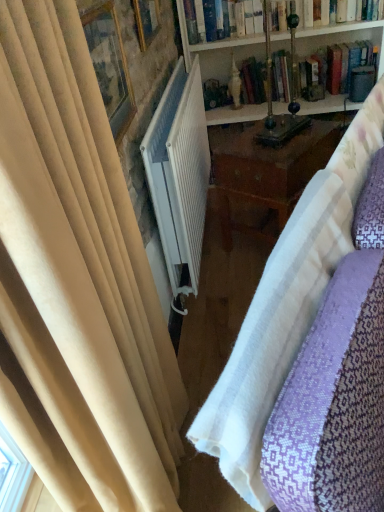
Image resolution: width=384 pixels, height=512 pixels. Find the location of `hardcover book at upper center`. hardcover book at upper center is located at coordinates (338, 28).

Describe the element at coordinates (179, 172) in the screenshot. The width and height of the screenshot is (384, 512). I see `white ribbed radiator at center` at that location.

At what (x,y) coordinates should I click in order to perform the action: click on white ribbed radiator at center. Please return your answer as a coordinate pair (x, y). Looking at the image, I should click on (179, 172).

What do you see at coordinates (271, 94) in the screenshot? Image resolution: width=384 pixels, height=512 pixels. I see `brass table lamp at center` at bounding box center [271, 94].

Locate an element on the screen. white wooden bookcase at upper center is located at coordinates (218, 50).

Identify the location of hardcover book at upper center. The image size is (384, 512). (338, 28).

Is white ribbed radiator at center at the back of white textured fabric at center?

Yes, white textured fabric at center is positioned with its back facing white ribbed radiator at center.

Does white textured fabric at center have a greater height compared to white ribbed radiator at center?

Indeed, white textured fabric at center has a greater height compared to white ribbed radiator at center.

From a real-world perspective, who is located higher, white textured fabric at center or white ribbed radiator at center?

In real-world perspective, white ribbed radiator at center is above.

Find the location of a particular element. This screenshot has width=384, height=512. radiator behind the white textured fabric at center is located at coordinates (179, 172).

Can you confirm if brass table lamp at center is shorter than hardcover book at upper center?

Incorrect, the height of brass table lamp at center does not fall short of that of hardcover book at upper center.

Is brass table lamp at center surrounding hardcover book at upper center?

No, brass table lamp at center does not contain hardcover book at upper center.

Is brass table lamp at center closer to the viewer compared to hardcover book at upper center?

Yes, the depth of brass table lamp at center is less than that of hardcover book at upper center.

Is white ribbed radiator at center positioned far away from wooden picture frame at upper center, the 1th picture frame from the top?

No, there isn't a large distance between white ribbed radiator at center and wooden picture frame at upper center, the 1th picture frame from the top.

Based on the photo, is white ribbed radiator at center completely or partially outside of wooden picture frame at upper center, the second picture frame from the bottom?

Yes, white ribbed radiator at center is outside of wooden picture frame at upper center, the second picture frame from the bottom.

From the image's perspective, relative to wooden picture frame at upper center, marked as the 1th picture frame in a back-to-front arrangement, is white ribbed radiator at center above or below?

white ribbed radiator at center is situated lower than wooden picture frame at upper center, marked as the 1th picture frame in a back-to-front arrangement, in the image.

Considering the sizes of objects matte gold picture frame at upper left, the 2th picture frame positioned from the back, and wooden picture frame at upper center, the 1th picture frame from the top, in the image provided, who is bigger, matte gold picture frame at upper left, the 2th picture frame positioned from the back, or wooden picture frame at upper center, the 1th picture frame from the top,?

wooden picture frame at upper center, the 1th picture frame from the top, is bigger.

Is matte gold picture frame at upper left, the first picture frame positioned from the bottom, looking in the opposite direction of wooden picture frame at upper center, the 2th picture frame from the front?

That's not correct — matte gold picture frame at upper left, the first picture frame positioned from the bottom, is not looking away from wooden picture frame at upper center, the 2th picture frame from the front.

Can you confirm if matte gold picture frame at upper left, the first picture frame positioned from the bottom, is positioned to the right of wooden picture frame at upper center, marked as the 1th picture frame in a back-to-front arrangement?

No.

Is matte gold picture frame at upper left, the first picture frame positioned from the bottom, not inside wooden picture frame at upper center, the second picture frame from the bottom?

Yes, matte gold picture frame at upper left, the first picture frame positioned from the bottom, is outside of wooden picture frame at upper center, the second picture frame from the bottom.

From the image's perspective, is white textured fabric at center located above or below brass table lamp at center?

Clearly, from the image's perspective, white textured fabric at center is below brass table lamp at center.

Does point (224, 475) lie in front of point (269, 61)?

Yes, it is in front of point (269, 61).

Where is `studio couch in front of the brass table lamp at center`? studio couch in front of the brass table lamp at center is located at coordinates (286, 307).

Between white ribbed radiator at center and matte gold picture frame at upper left, which is the second picture frame in top-to-bottom order, which one has more height?

white ribbed radiator at center is taller.

What are the coordinates of `picture frame that appears in front of the white ribbed radiator at center` in the screenshot? It's located at (109, 64).

Which is behind, white ribbed radiator at center or matte gold picture frame at upper left, which is the second picture frame in top-to-bottom order?

white ribbed radiator at center is further from the camera.

Which point is more distant from viewer, (197, 106) or (114, 120)?

The point (197, 106) is more distant.

Considering the positions of objects hardcover book at upper center and white wooden bookcase at upper center in the image provided, who is more to the right, hardcover book at upper center or white wooden bookcase at upper center?

white wooden bookcase at upper center is more to the right.

Who is more distant, hardcover book at upper center or white wooden bookcase at upper center?

hardcover book at upper center is behind.

Which of these two, hardcover book at upper center or white wooden bookcase at upper center, is bigger?

white wooden bookcase at upper center.

Identify the location of radiator behind the white textured fabric at center. Image resolution: width=384 pixels, height=512 pixels. (179, 172).

At what (x,y) coordinates should I click in order to perform the action: click on book to the right of brass table lamp at center. Please return your answer as a coordinate pair (x, y). The image size is (384, 512). Looking at the image, I should click on (338, 28).

Based on their spatial positions, is hardcover book at upper center or white ribbed radiator at center further from white textured fabric at center?

hardcover book at upper center is positioned further to the anchor white textured fabric at center.

Estimate the real-world distances between objects in this image. Which object is closer to white ribbed radiator at center, hardcover book at upper center or white textured fabric at center?

white textured fabric at center lies closer to white ribbed radiator at center than the other object.

Based on their spatial positions, is hardcover book at upper center or white textured fabric at center further from matte gold picture frame at upper left, the 2th picture frame positioned from the back?

The object further to matte gold picture frame at upper left, the 2th picture frame positioned from the back, is hardcover book at upper center.

When comparing their distances from white ribbed radiator at center, does white textured fabric at center or white wooden bookcase at upper center seem closer?

Among the two, white wooden bookcase at upper center is located nearer to white ribbed radiator at center.

Based on their spatial positions, is white textured fabric at center or matte gold picture frame at upper left, which is the second picture frame in top-to-bottom order, further from wooden picture frame at upper center, the 1th picture frame from the top?

white textured fabric at center is positioned further to the anchor wooden picture frame at upper center, the 1th picture frame from the top.

Which object lies nearer to the anchor point white ribbed radiator at center, white wooden bookcase at upper center or wooden picture frame at upper center, the second picture frame from the bottom?

wooden picture frame at upper center, the second picture frame from the bottom.

Based on their spatial positions, is hardcover book at upper center or white ribbed radiator at center further from wooden picture frame at upper center, the 1th picture frame from the top?

hardcover book at upper center is further to wooden picture frame at upper center, the 1th picture frame from the top.

When comparing their distances from white wooden bookcase at upper center, does white textured fabric at center or wooden picture frame at upper center, the 1th picture frame from the top, seem closer?

wooden picture frame at upper center, the 1th picture frame from the top, is positioned closer to the anchor white wooden bookcase at upper center.

Locate an element on the screen. Image resolution: width=384 pixels, height=512 pixels. radiator between matte gold picture frame at upper left, the 2th picture frame positioned from the back, and brass table lamp at center, along the z-axis is located at coordinates (179, 172).

Find the location of a particular element. The width and height of the screenshot is (384, 512). picture frame between matte gold picture frame at upper left, which is the second picture frame in top-to-bottom order, and white wooden bookcase at upper center, along the z-axis is located at coordinates [146, 21].

Locate an element on the screen. The image size is (384, 512). radiator between matte gold picture frame at upper left, which is the second picture frame in top-to-bottom order, and white wooden bookcase at upper center, along the z-axis is located at coordinates (179, 172).

At what (x,y) coordinates should I click in order to perform the action: click on bookcase between hardcover book at upper center and brass table lamp at center in the vertical direction. Please return your answer as a coordinate pair (x, y). The image size is (384, 512). Looking at the image, I should click on (218, 50).